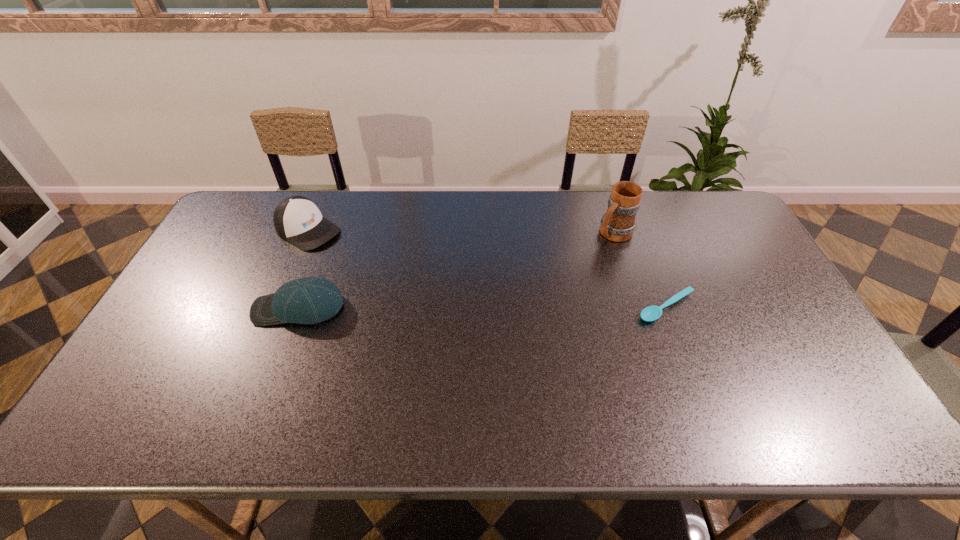
Locate which object ranks third in proximity to the shortest object. Please provide its 2D coordinates. Your answer should be formatted as a tuple, i.e. [(x, y)], where the tuple contains the x and y coordinates of a point satisfying the conditions above.

[(297, 219)]

Find the location of a particular element. vacant region that satisfies the following two spatial constraints: 1. on the front side of the second tallest object; 2. on the left side of the spoon is located at coordinates (276, 307).

I want to click on vacant point that satisfies the following two spatial constraints: 1. on the front side of the third shortest object; 2. on the left side of the spoon, so click(x=276, y=307).

Find the location of a particular element. The height and width of the screenshot is (540, 960). vacant space that satisfies the following two spatial constraints: 1. on the back side of the mug; 2. on the right side of the baseball cap is located at coordinates (326, 233).